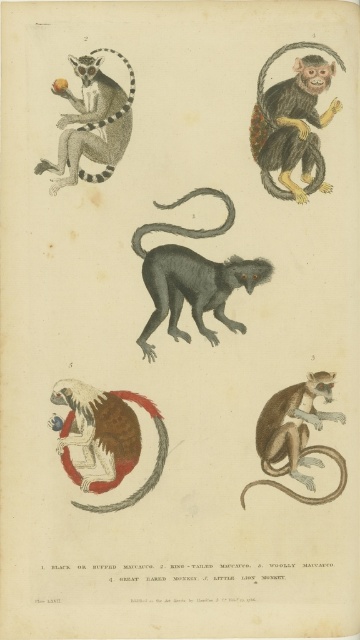
Question: Which point is closer to the camera?

Choices:
 (A) (290, 461)
 (B) (78, 160)
 (C) (228, 196)
 (D) (86, 387)

Answer: (A)

Question: Estimate the real-world distances between objects in this image. Which object is farther from the gray matte monkey at center?

Choices:
 (A) brown fur monkey at center
 (B) shiny black monkey at upper right
 (C) black matte tail at center

Answer: (A)

Question: Is the position of ring-tailed lemur at upper left more distant than that of black matte tail at center?

Choices:
 (A) no
 (B) yes

Answer: (A)

Question: Is brown fur monkey at center thinner than shiny black monkey at upper right?

Choices:
 (A) no
 (B) yes

Answer: (A)

Question: Which object is the farthest from the shiny black monkey at upper right?

Choices:
 (A) brown textured monkey at lower right
 (B) ring-tailed lemur at upper left
 (C) gray matte monkey at center

Answer: (A)

Question: Can you confirm if gray matte monkey at center is wider than brown textured monkey at lower right?

Choices:
 (A) yes
 (B) no

Answer: (A)